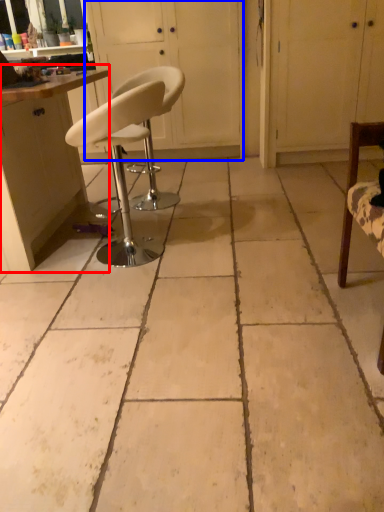
Question: Which point is closer to the camera, cabinetry (highlighted by a red box) or screen door (highlighted by a blue box)?

Choices:
 (A) cabinetry
 (B) screen door

Answer: (A)